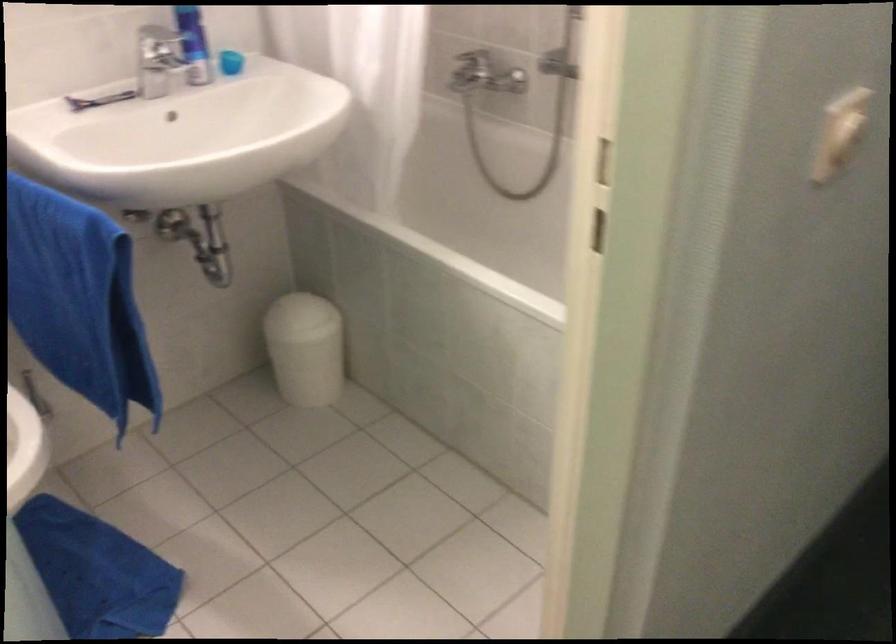
Describe the element at coordinates (230, 62) in the screenshot. I see `a blue plastic cup` at that location.